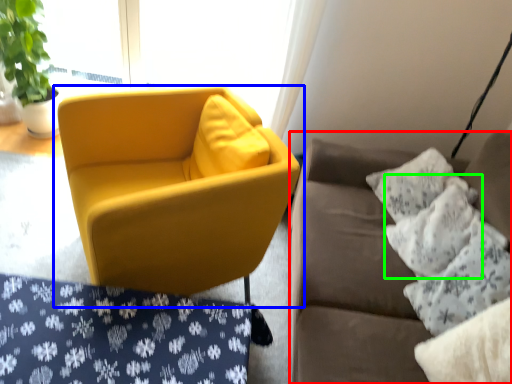
Question: Which is farther away from studio couch (highlighted by a red box)? chair (highlighted by a blue box) or pillow (highlighted by a green box)?

Choices:
 (A) chair
 (B) pillow

Answer: (A)